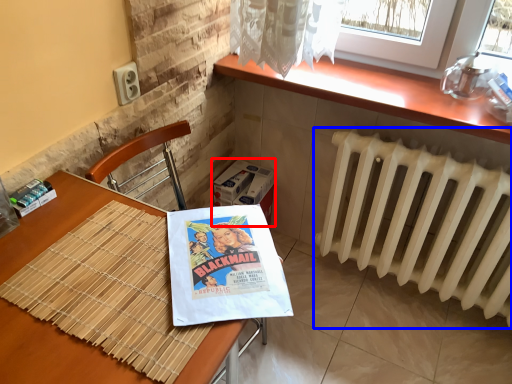
Question: Which of the following is the closest to the observer, cardboard box (highlighted by a red box) or radiator (highlighted by a blue box)?

Choices:
 (A) cardboard box
 (B) radiator

Answer: (B)